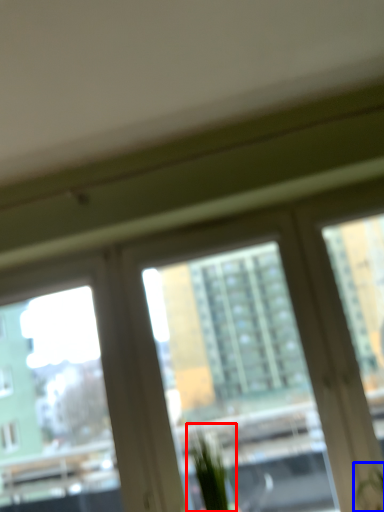
Question: Which of the following is the closest to the observer, plant (highlighted by a red box) or plant (highlighted by a blue box)?

Choices:
 (A) plant
 (B) plant

Answer: (B)